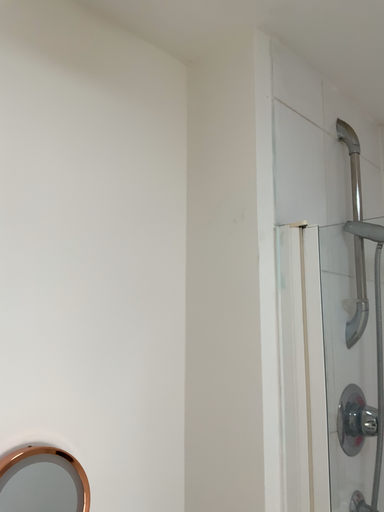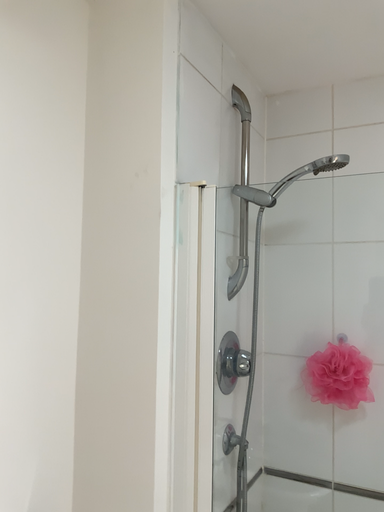
Question: Which way did the camera rotate in the video?

Choices:
 (A) rotated upward
 (B) rotated downward

Answer: (B)